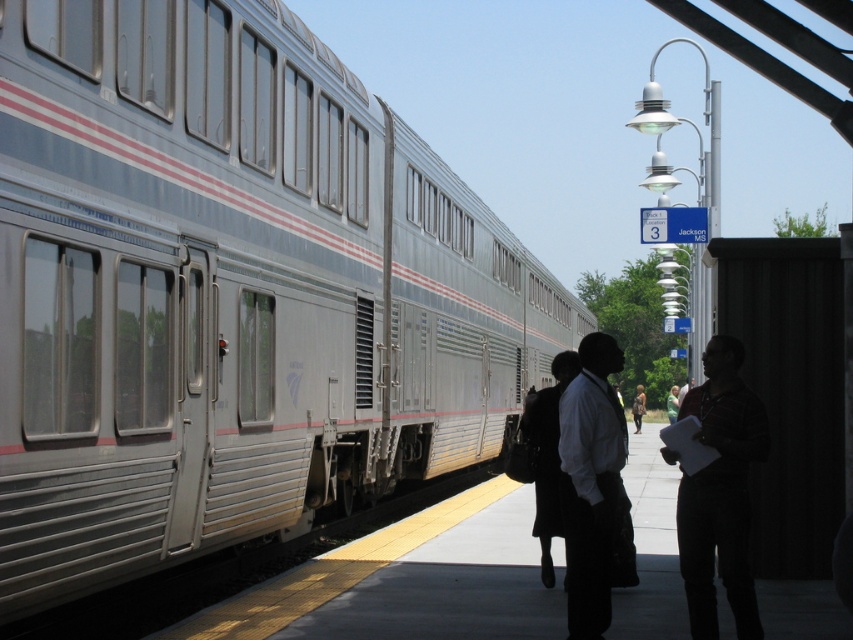
Looking at this image, you are a passenger on the platform at Jackson MS station. You see the silver metallic train at left and the dark gray suit at right. Which object is closer to the platform edge with the yellow tactile paving strip?

The dark gray suit at right is closer to the platform edge with the yellow tactile paving strip because the silver metallic train at left is positioned on the right side of it, meaning the dark gray suit at right is nearer to the edge.

From the picture: You are a photographer planning to take a photo of the silver metallic train at left and the dark gray suit at right in the train station. Since you want both subjects to appear proportionally sized in the frame, which subject should you move closer to?

You should move closer to the silver metallic train at left because it is larger than the dark gray suit at right, so reducing its size in the frame will help balance their proportions.